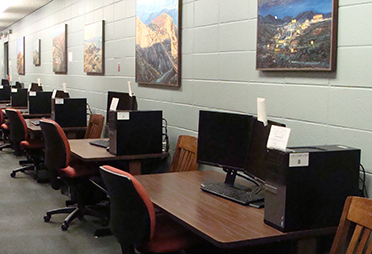
At what (x,y) coordinates should I click in order to perform the action: click on brick wall. Please return your answer as a coordinate pair (x, y). This screenshot has width=372, height=254. Looking at the image, I should click on [233, 86].